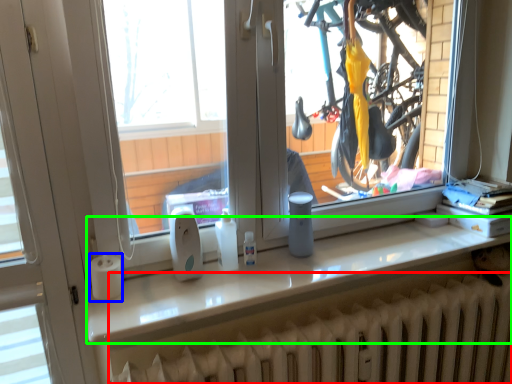
Question: Considering the real-world distances, which object is closest to radiator (highlighted by a red box)? paper towel (highlighted by a blue box) or counter top (highlighted by a green box).

Choices:
 (A) paper towel
 (B) counter top

Answer: (B)